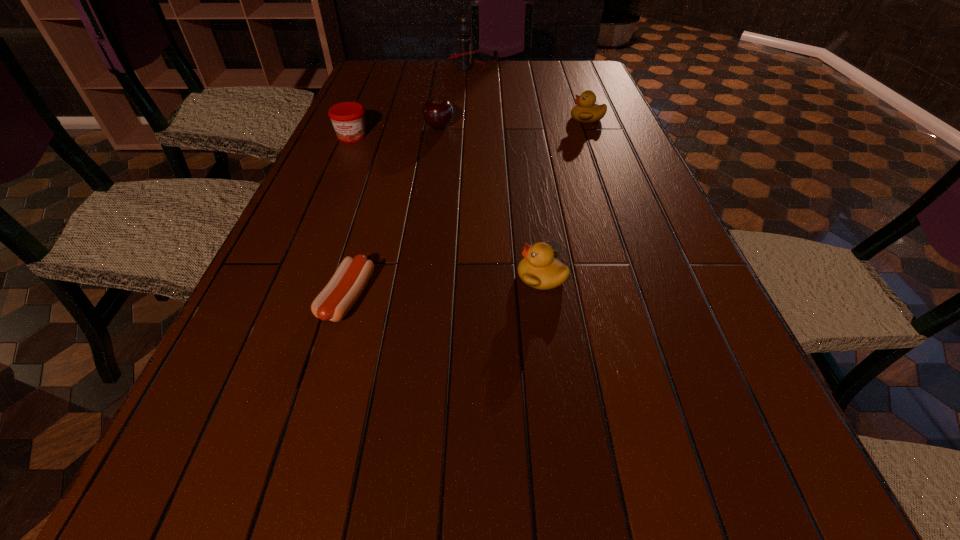
Where is `empty location between the rightmost object and the apple`? The height and width of the screenshot is (540, 960). empty location between the rightmost object and the apple is located at coordinates (514, 123).

Identify the location of free space that is in between the left duckling and the apple. This screenshot has height=540, width=960. (491, 201).

Locate an element on the screen. This screenshot has height=540, width=960. empty space that is in between the second object from left to right and the fifth object from left to right is located at coordinates (444, 287).

The height and width of the screenshot is (540, 960). Identify the location of vacant point located between the jam and the root beer. (x=409, y=102).

I want to click on empty space that is in between the left duckling and the tallest object, so click(504, 172).

This screenshot has height=540, width=960. I want to click on empty space that is in between the leftmost object and the farther duckling, so click(x=469, y=127).

Image resolution: width=960 pixels, height=540 pixels. Find the location of `free space between the second object from right to left and the tallest object`. free space between the second object from right to left and the tallest object is located at coordinates click(x=504, y=172).

The height and width of the screenshot is (540, 960). Find the location of `object that is the fifth closest to the root beer`. object that is the fifth closest to the root beer is located at coordinates (337, 298).

Identify the location of object that stands as the second closest to the fifth object from left to right. (438, 112).